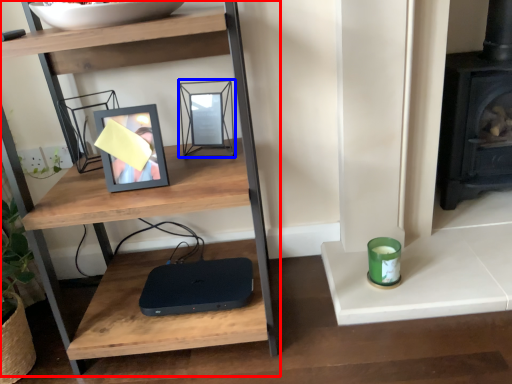
Question: Which object is further to the camera taking this photo, shelf (highlighted by a red box) or picture frame (highlighted by a blue box)?

Choices:
 (A) shelf
 (B) picture frame

Answer: (B)